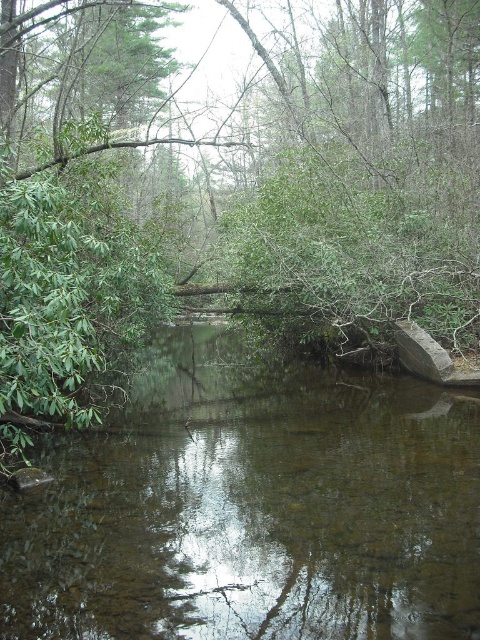
You are standing in the forest and see the green leafy tree at center and the brown reflective water at center. Which object is positioned to the right side of the other?

The green leafy tree at center is to the right of brown reflective water at center.

You are standing in the forest and want to take a photo of the green leafy tree at center and the brown reflective water at center. Which one should you focus on first if you want both to be in sharp focus?

You should focus on the green leafy tree at center first because it is closer to you than the brown reflective water at center. By focusing on the closer object, you can ensure both are in focus using the depth of field.

You are a hiker who wants to cross the brown reflective water at center using a 10 meter long plank. The green leafy tree at center is in the way. Can you place the plank between them to cross?

The distance between the green leafy tree at center and brown reflective water at center is 9.44 meters. Since the plank is 10 meters long, it can span the gap between them, allowing you to cross safely.